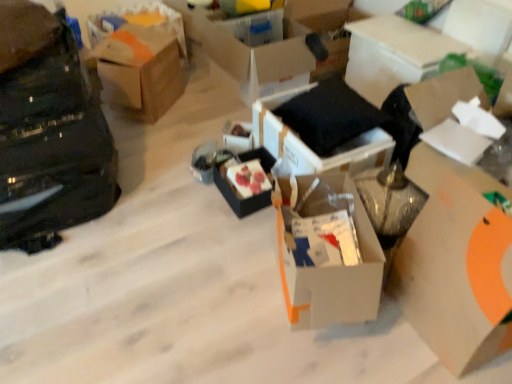
Identify the location of vacant region in front of black matte box at center, acting as the second box starting from the left. The height and width of the screenshot is (384, 512). (237, 233).